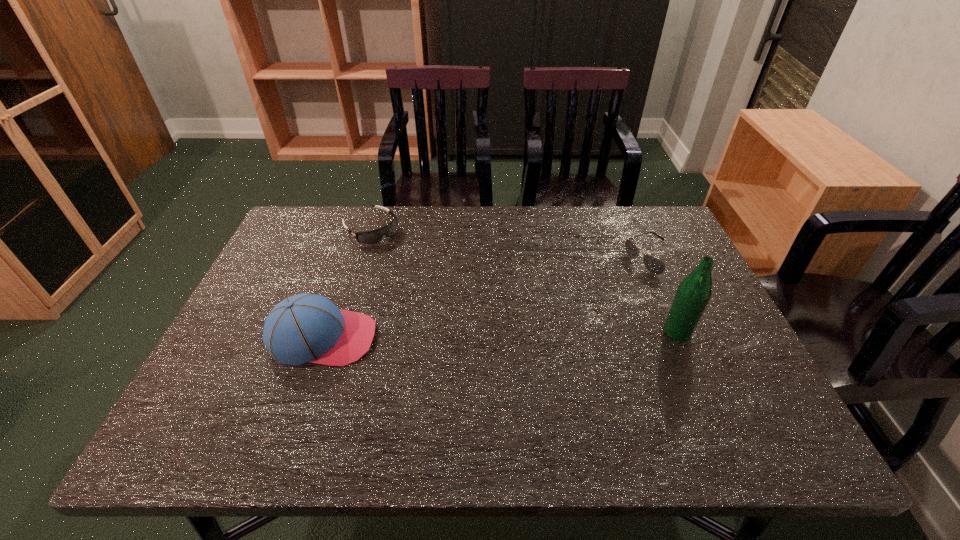
The height and width of the screenshot is (540, 960). In order to click on baseball cap in this screenshot , I will do `click(302, 328)`.

Find the location of a particular element. This screenshot has height=540, width=960. the tallest object is located at coordinates (694, 292).

The height and width of the screenshot is (540, 960). I want to click on sunglasses, so click(x=655, y=266).

What are the coordinates of `goggles` in the screenshot? It's located at (374, 236).

What are the coordinates of `vacant space located on the front-facing side of the baseball cap` in the screenshot? It's located at (487, 338).

This screenshot has width=960, height=540. Identify the location of vacant space located 0.210m on the left of the tallest object. (574, 332).

The width and height of the screenshot is (960, 540). What are the coordinates of `vacant area situated on the front-facing side of the sunglasses` in the screenshot? It's located at click(x=589, y=293).

Where is `vacant space located on the front-facing side of the sunglasses`? This screenshot has height=540, width=960. vacant space located on the front-facing side of the sunglasses is located at coordinates (619, 277).

Find the location of a particular element. free spot located on the front-facing side of the sunglasses is located at coordinates (547, 314).

The width and height of the screenshot is (960, 540). What are the coordinates of `free space located 0.340m on the front and sides of the goggles` in the screenshot? It's located at (457, 304).